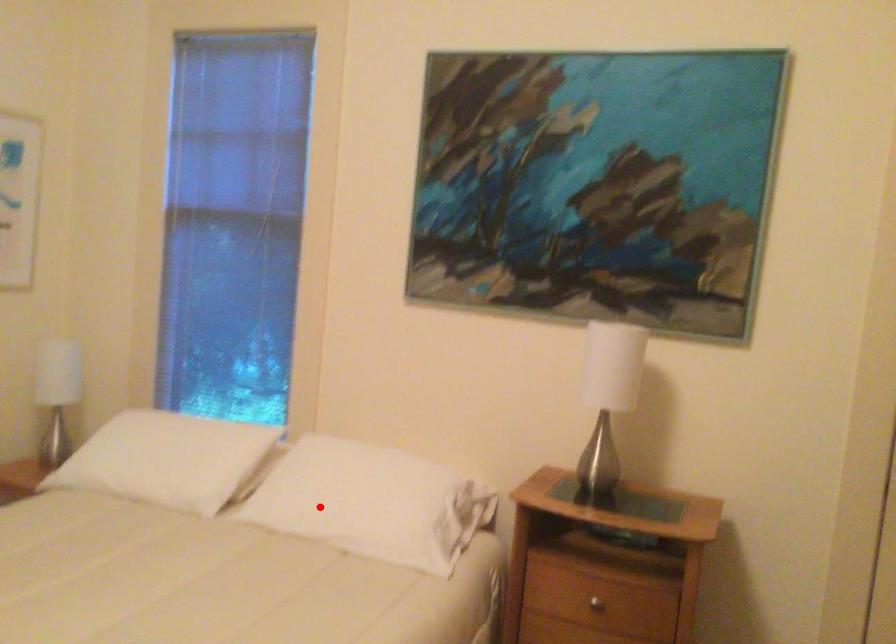
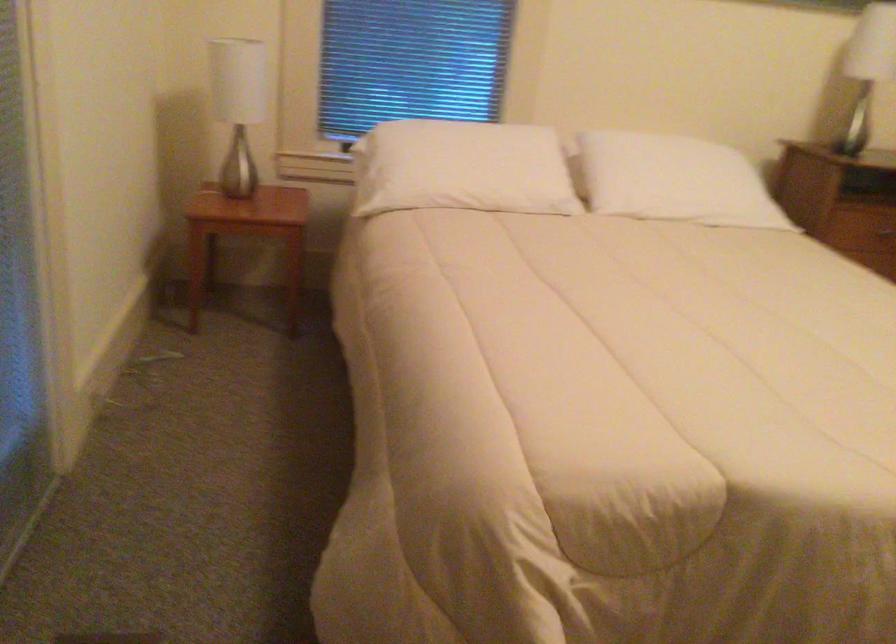
The point at the highlighted location is marked in the first image. Where is the corresponding point in the second image?

(673, 180)